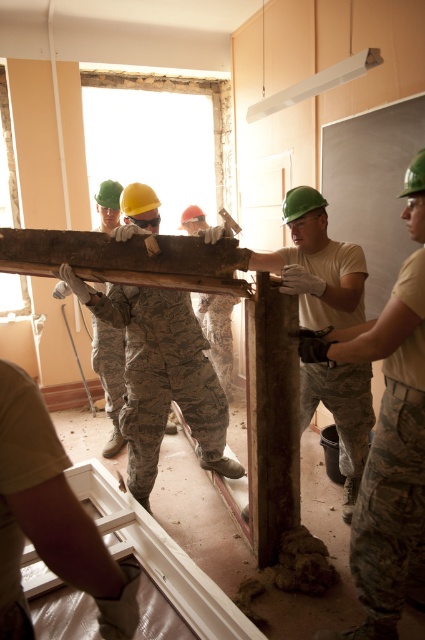
Who is positioned more to the right, matte green helmet at center or rusty metal pole at center?

matte green helmet at center is more to the right.

Between matte green helmet at center and rusty metal pole at center, which one appears on the left side from the viewer's perspective?

Positioned to the left is rusty metal pole at center.

Between point (414, 440) and point (303, 314), which one is positioned behind?

Positioned behind is point (303, 314).

Identify the location of matte green helmet at center. This screenshot has width=425, height=640. (390, 438).

Is point (144, 360) positioned before point (323, 236)?

No, (144, 360) is further to viewer.

This screenshot has height=640, width=425. What do you see at coordinates (161, 378) in the screenshot?
I see `camouflage fabric uniform at center` at bounding box center [161, 378].

Identify the location of camouflage fabric uniform at center. The image size is (425, 640). (161, 378).

What do you see at coordinates (390, 438) in the screenshot?
I see `matte green helmet at center` at bounding box center [390, 438].

You are a GUI agent. You are given a task and a screenshot of the screen. Output one action in this format:
    pyautogui.click(x=<x>, y=<y>)
    Task: Click on the matte green helmet at center
    
    Given the screenshot: What is the action you would take?
    pyautogui.click(x=390, y=438)